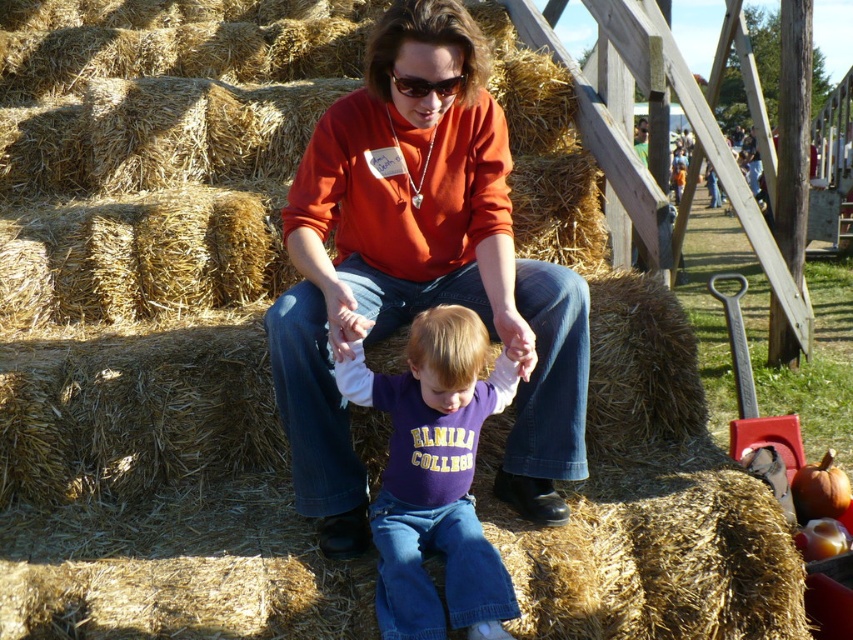
Question: Among these points, which one is nearest to the camera?

Choices:
 (A) (306, 506)
 (B) (432, 346)

Answer: (B)

Question: Does orange cotton shirt at center have a smaller size compared to matte black sunglasses at center?

Choices:
 (A) no
 (B) yes

Answer: (A)

Question: Does orange cotton shirt at center have a lesser width compared to matte black sunglasses at center?

Choices:
 (A) no
 (B) yes

Answer: (A)

Question: Among these points, which one is farthest from the camera?

Choices:
 (A) click(451, 321)
 (B) click(412, 81)
 (C) click(375, 282)

Answer: (C)

Question: Among these objects, which one is farthest from the camera?

Choices:
 (A) matte black sunglasses at center
 (B) orange cotton shirt at center

Answer: (A)

Question: Can you confirm if purple cotton shirt at center is smaller than matte black sunglasses at center?

Choices:
 (A) no
 (B) yes

Answer: (A)